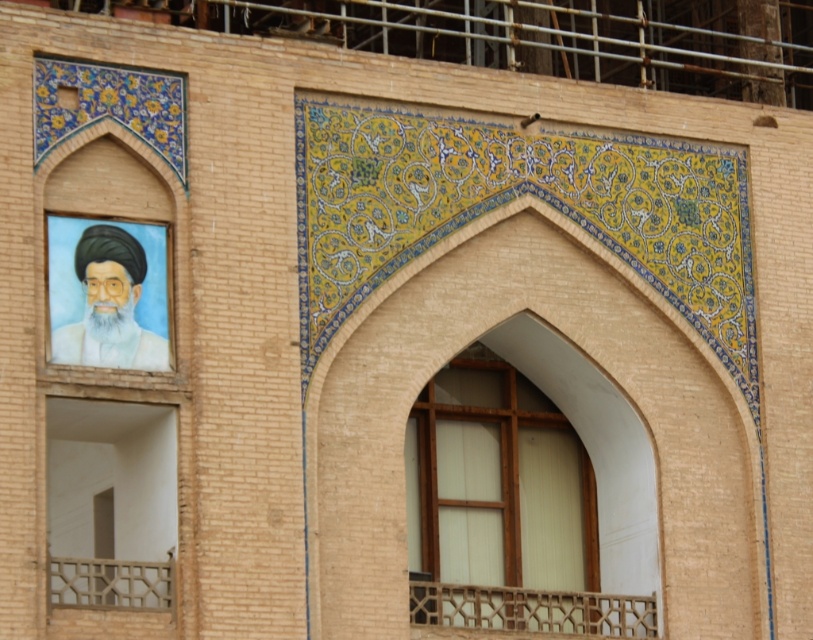
Question: From the image, what is the correct spatial relationship of wooden lattice balcony at lower left in relation to white matte robe at left?

Choices:
 (A) above
 (B) below

Answer: (B)

Question: Based on their relative distances, which object is farther from the matte oil painting portrait at upper left?

Choices:
 (A) wooden at center
 (B) wooden lattice at lower center

Answer: (A)

Question: Among these points, which one is farthest from the camera?

Choices:
 (A) (53, 328)
 (B) (563, 442)

Answer: (B)

Question: Which of the following is the farthest from the observer?

Choices:
 (A) (480, 598)
 (B) (114, 570)
 (C) (88, 340)

Answer: (A)

Question: Is matte oil painting portrait at upper left to the right of wooden lattice at lower center from the viewer's perspective?

Choices:
 (A) no
 (B) yes

Answer: (A)

Question: Is wooden at center closer to the viewer compared to matte oil painting portrait at upper left?

Choices:
 (A) no
 (B) yes

Answer: (A)